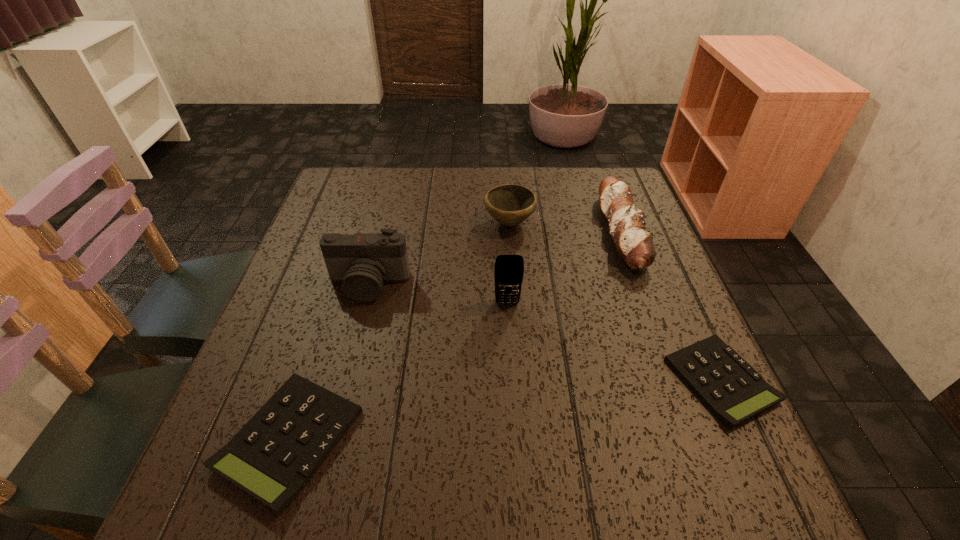
Where is `object present at the near left corner`? This screenshot has height=540, width=960. object present at the near left corner is located at coordinates (276, 453).

You are a GUI agent. You are given a task and a screenshot of the screen. Output one action in this format:
    pyautogui.click(x=<x>, y=<y>)
    Task: Click on the object located in the far right corner section of the desktop
    
    Given the screenshot: What is the action you would take?
    tap(626, 223)

Locate an element on the screen. The height and width of the screenshot is (540, 960). object that is at the near right corner is located at coordinates (730, 387).

Find the location of a particular element. The height and width of the screenshot is (540, 960). free point at the far edge is located at coordinates coord(444,189).

Identify the location of vacant position at the near edge of the desktop. The height and width of the screenshot is (540, 960). (379, 422).

This screenshot has height=540, width=960. In the image, there is a desktop. In order to click on vacant space at the left edge in this screenshot , I will do `click(326, 287)`.

The width and height of the screenshot is (960, 540). In the image, there is a desktop. What are the coordinates of `free space at the right edge` in the screenshot? It's located at (685, 396).

You are a GUI agent. You are given a task and a screenshot of the screen. Output one action in this format:
    pyautogui.click(x=<x>, y=<y>)
    Task: Click on the blank space at the far left corner of the desktop
    This screenshot has height=540, width=960.
    Given the screenshot: What is the action you would take?
    pyautogui.click(x=345, y=201)

You are a GUI agent. You are given a task and a screenshot of the screen. Output one action in this format:
    pyautogui.click(x=<x>, y=<y>)
    Task: Click on the free spot at the far right corner of the desktop
    This screenshot has width=960, height=540.
    Given the screenshot: What is the action you would take?
    pyautogui.click(x=585, y=175)

Identify the location of free space between the cellular telephone and the shortest object. (613, 342).